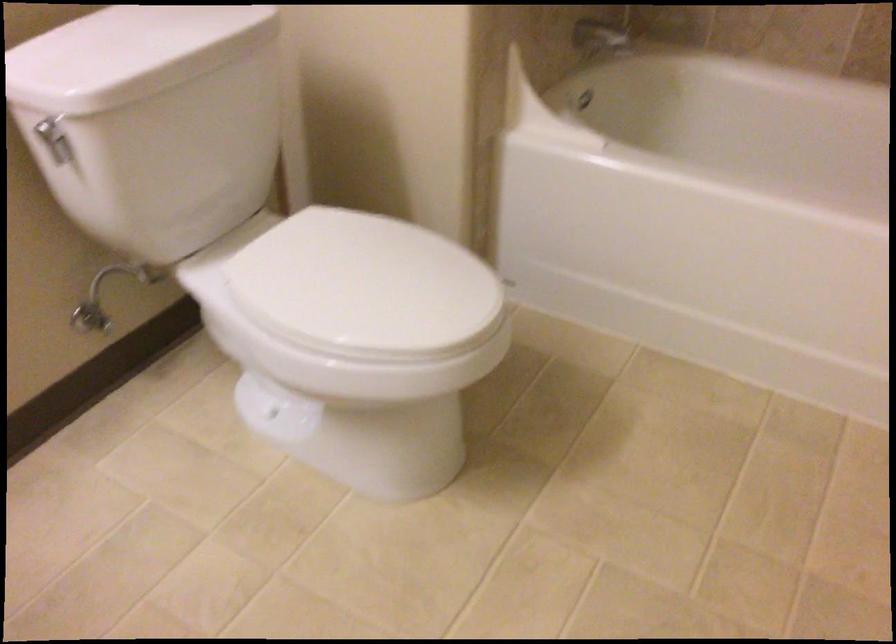
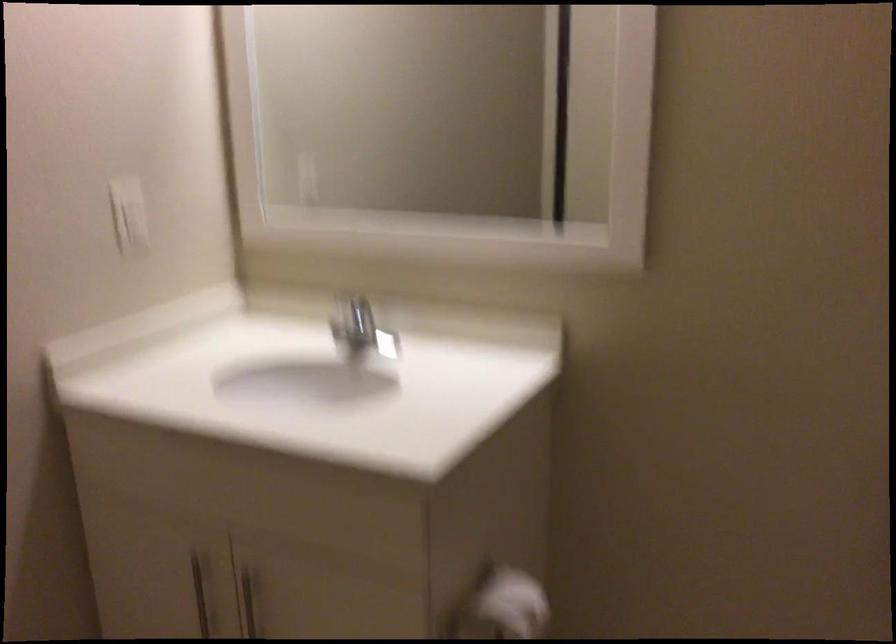
Question: How did the camera likely rotate?

Choices:
 (A) Left
 (B) Right
 (C) Up
 (D) Down

Answer: (A)